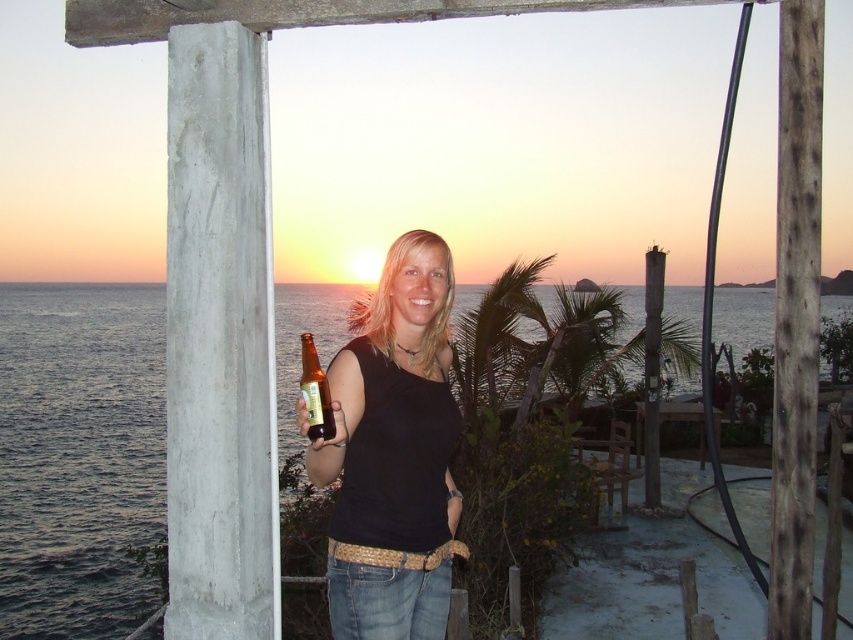
Question: Which point is closer to the camera?

Choices:
 (A) (308, 369)
 (B) (397, 317)

Answer: (A)

Question: Is matte black tank top at center positioned before translucent glass bottle at center?

Choices:
 (A) no
 (B) yes

Answer: (A)

Question: Can you confirm if matte black tank top at center is positioned to the right of translucent glass bottle at center?

Choices:
 (A) yes
 (B) no

Answer: (A)

Question: Among these objects, which one is farthest from the camera?

Choices:
 (A) translucent glass bottle at center
 (B) matte black tank top at center

Answer: (B)

Question: Does blue water at lower left have a lesser width compared to translucent glass bottle at center?

Choices:
 (A) yes
 (B) no

Answer: (B)

Question: Which point is farther from the camera taking this photo?

Choices:
 (A) (312, 342)
 (B) (450, 413)

Answer: (A)